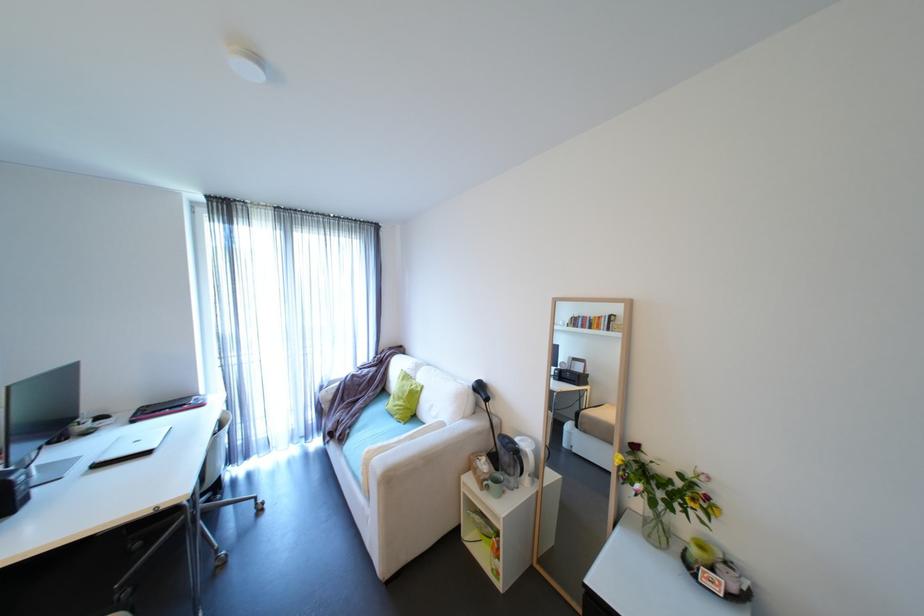
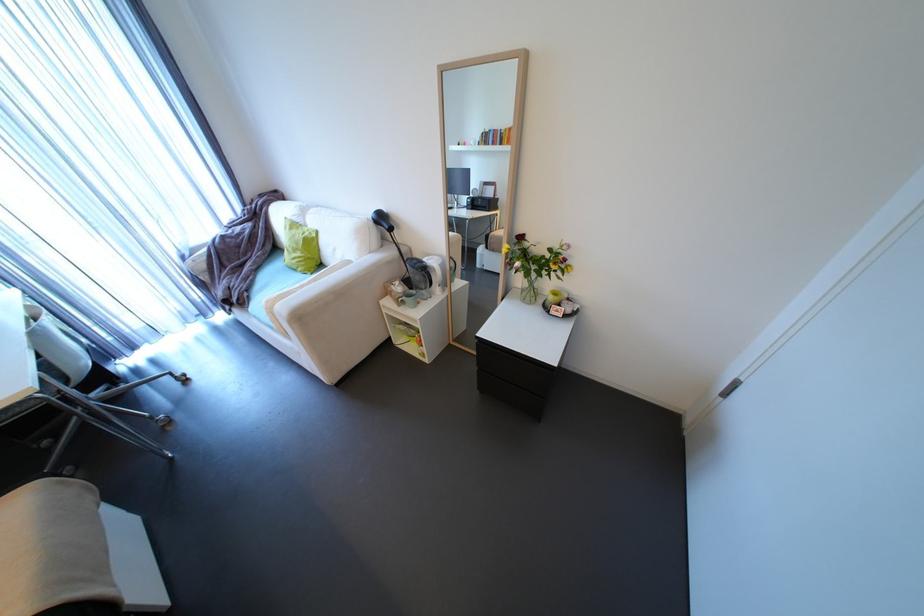
Locate, in the second image, the point that corresponds to (x=411, y=402) in the first image.

(310, 253)